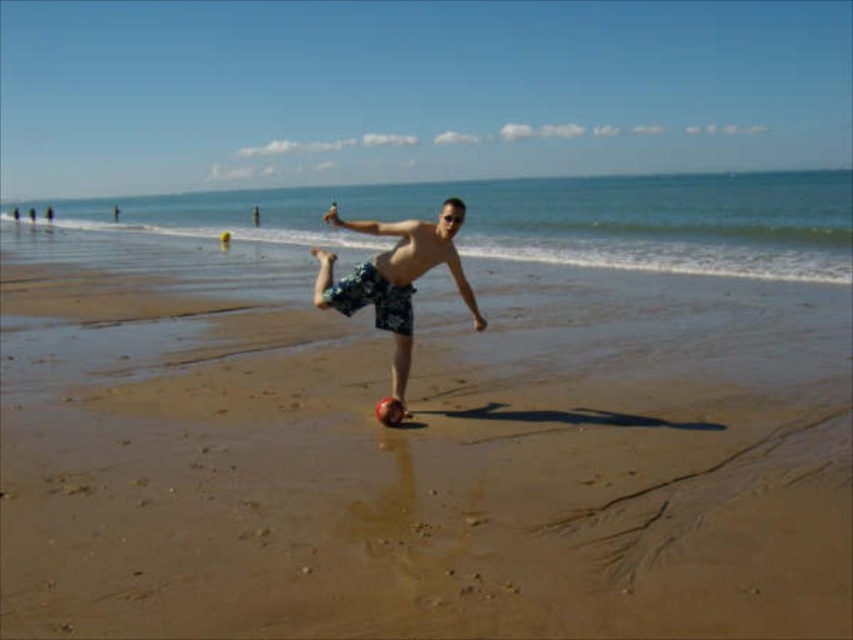
Question: Can you confirm if floral shorts at center is thinner than floral-patterned shorts at center?

Choices:
 (A) yes
 (B) no

Answer: (B)

Question: Can you confirm if sandy beach at center is positioned above floral-patterned shorts at center?

Choices:
 (A) no
 (B) yes

Answer: (A)

Question: Considering the relative positions of sandy beach at center and floral-patterned shorts at center in the image provided, where is sandy beach at center located with respect to floral-patterned shorts at center?

Choices:
 (A) above
 (B) below

Answer: (B)

Question: Among these points, which one is nearest to the camera?

Choices:
 (A) (660, 460)
 (B) (403, 289)
 (C) (386, 305)

Answer: (A)

Question: Which point is farther from the camera taking this photo?

Choices:
 (A) (315, 298)
 (B) (596, 486)
 (C) (341, 301)

Answer: (A)

Question: Which is farther from the sandy beach at center?

Choices:
 (A) floral shorts at center
 (B) floral-patterned shorts at center

Answer: (A)